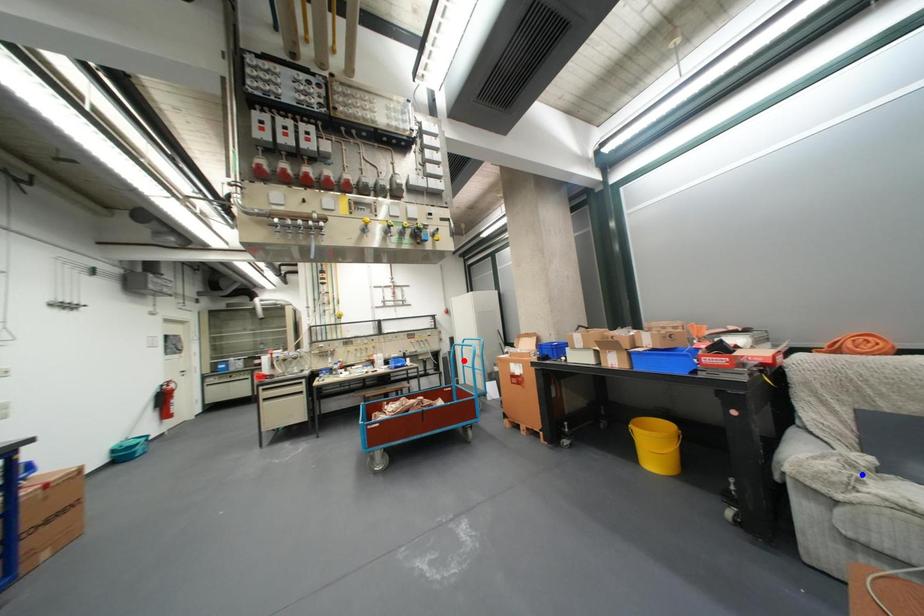
Question: Two points are marked on the image. Which point is closer to the camera?

Choices:
 (A) Blue point is closer.
 (B) Red point is closer.

Answer: (A)